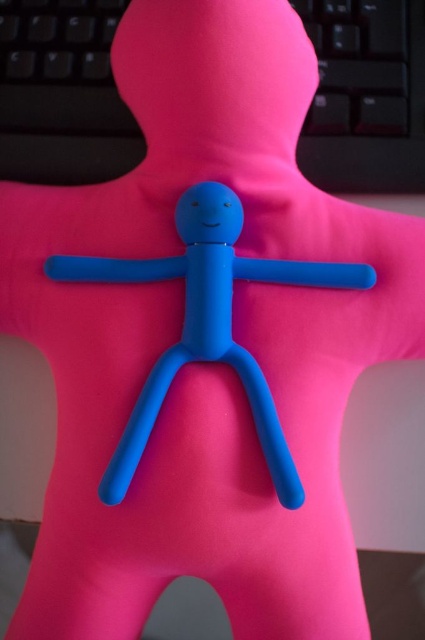
Is point (419, 64) behind point (141, 278)?

Yes, it is behind point (141, 278).

Can you confirm if black plastic keyboard at upper center is positioned to the right of matte blue stick figure at center?

Indeed, black plastic keyboard at upper center is positioned on the right side of matte blue stick figure at center.

Does point (11, 99) come behind point (144, 410)?

Yes, it is.

I want to click on black plastic keyboard at upper center, so click(61, 93).